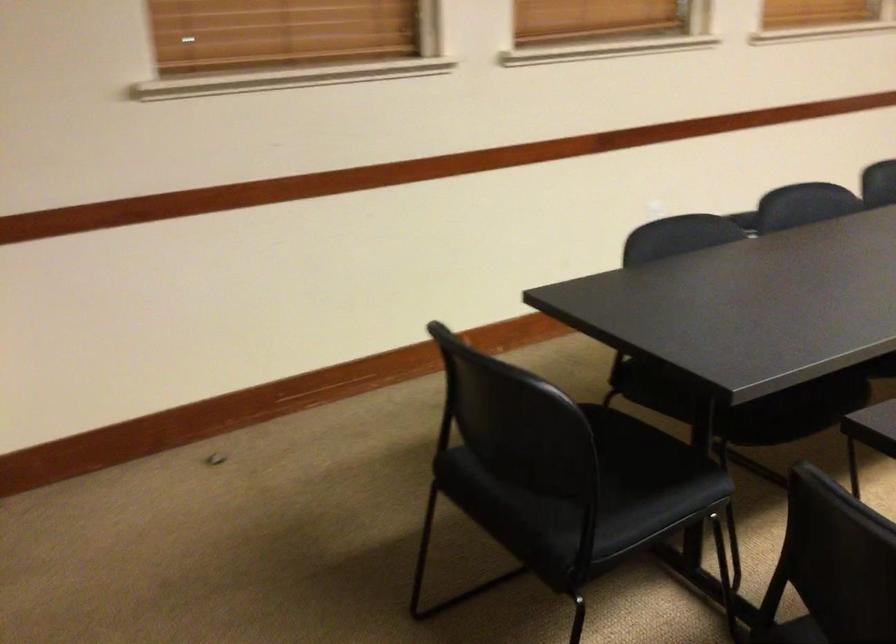
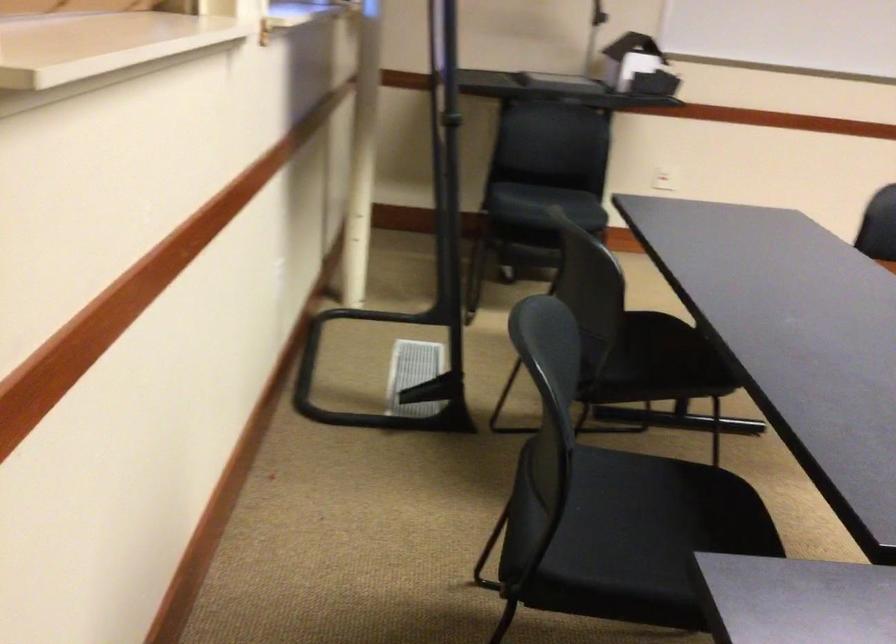
Question: What movement of the cameraman would produce the second image?

Choices:
 (A) Left
 (B) Right
 (C) Forward
 (D) Backward

Answer: (D)